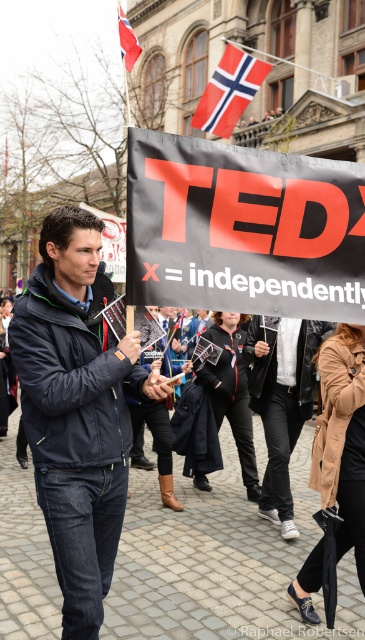
Question: Based on their relative distances, which object is nearer to the red fabric flag at upper left?

Choices:
 (A) red and white striped flag at upper center
 (B) black fabric banner at center
 (C) dark blue jacket at center

Answer: (A)

Question: Where is dark blue jacket at center located in relation to red fabric flag at upper left in the image?

Choices:
 (A) left
 (B) right

Answer: (B)

Question: Which object appears closest to the camera in this image?

Choices:
 (A) red and white striped flag at upper center
 (B) red fabric flag at upper left
 (C) dark blue jacket at center

Answer: (C)

Question: Which of the following is the farthest from the observer?

Choices:
 (A) pyautogui.click(x=58, y=321)
 (B) pyautogui.click(x=220, y=99)
 (C) pyautogui.click(x=201, y=225)

Answer: (B)

Question: Can you confirm if black fabric banner at center is wider than dark blue jacket at center?

Choices:
 (A) no
 (B) yes

Answer: (B)

Question: Can you confirm if dark blue jacket at center is smaller than red and white striped flag at upper center?

Choices:
 (A) yes
 (B) no

Answer: (A)